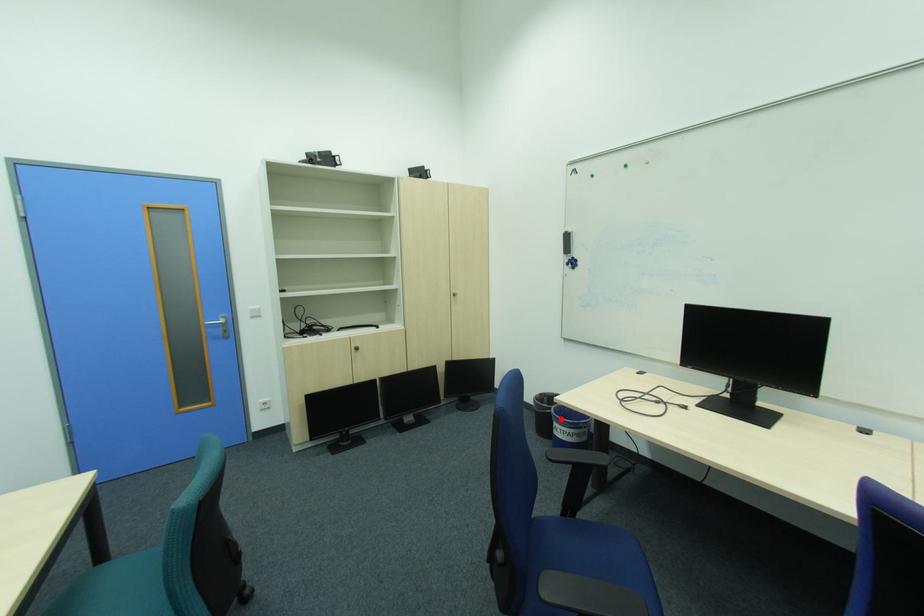
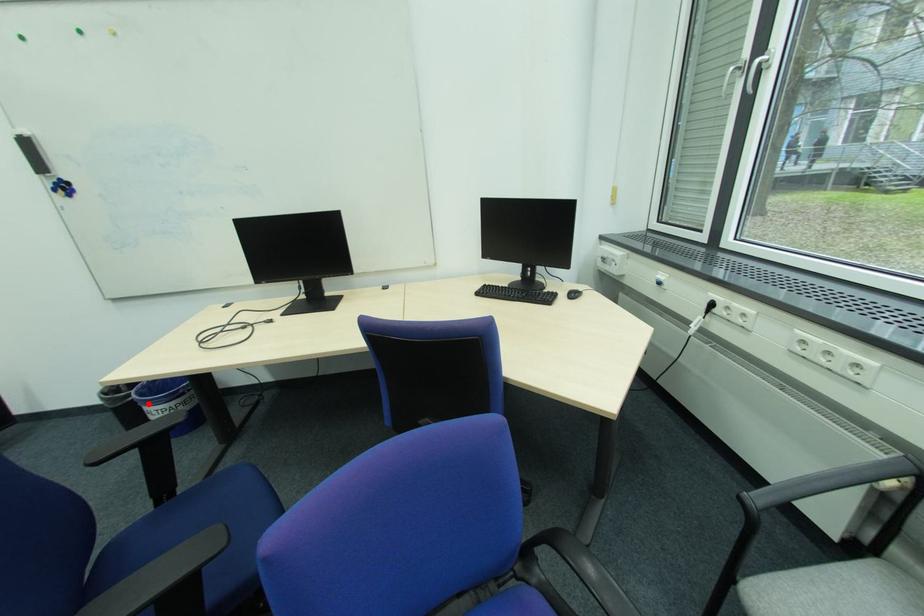
I am providing you with two images of the same scene from different viewpoints. A red point is marked on the first image and another point is marked on the second image. Are the points marked in image1 and image2 representing the same 3D position?

Yes